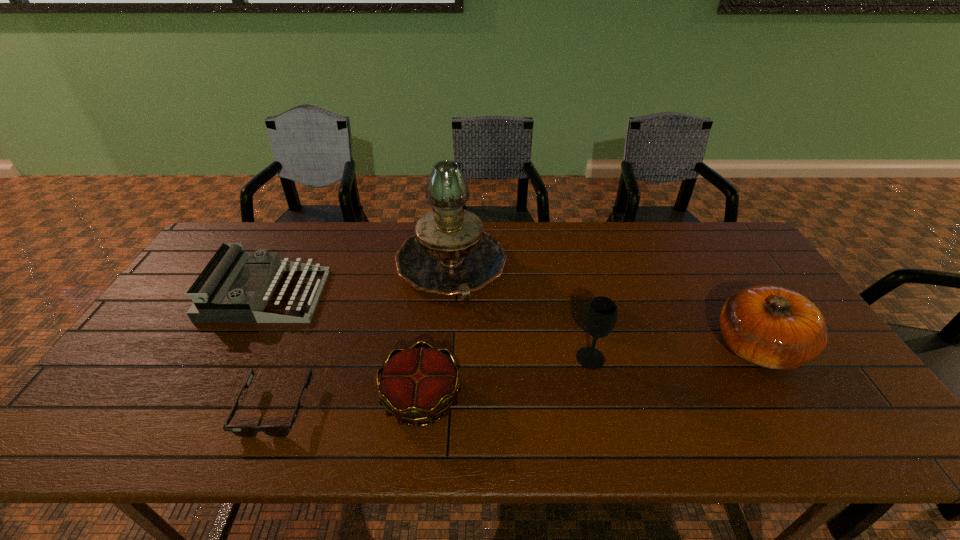
At what (x,y) coordinates should I click in order to perform the action: click on the tallest object. Please return your answer as a coordinate pair (x, y). Image resolution: width=960 pixels, height=540 pixels. Looking at the image, I should click on (450, 254).

Where is `the second object from right to left`? the second object from right to left is located at coordinates (600, 317).

The width and height of the screenshot is (960, 540). In order to click on the rightmost object in this screenshot , I will do `click(772, 327)`.

The image size is (960, 540). In order to click on typewriter in this screenshot , I will do `click(213, 300)`.

Identify the location of crown. The image size is (960, 540). (416, 384).

Find the location of `the shortest object`. the shortest object is located at coordinates (246, 431).

The height and width of the screenshot is (540, 960). Identify the location of vacant space situated on the front of the tallest object. (439, 423).

Find the location of a particular element. vacant space located on the back of the wineglass is located at coordinates (568, 264).

Identify the location of vacant space located on the back of the rightmost object. This screenshot has height=540, width=960. (688, 233).

Identify the location of vacant position located 0.370m on the typing side of the typewriter. The width and height of the screenshot is (960, 540). (444, 295).